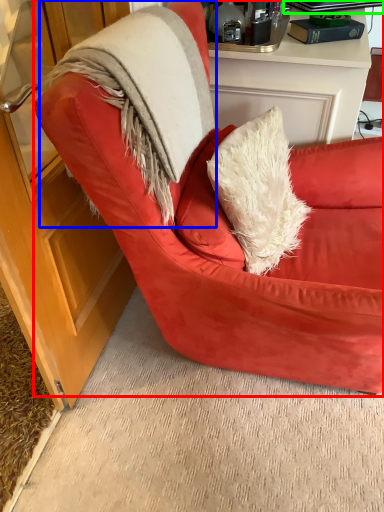
Question: Estimate the real-world distances between objects in this image. Which object is closer to chair (highlighted by a red box), fur coat (highlighted by a blue box) or laptop (highlighted by a green box)?

Choices:
 (A) fur coat
 (B) laptop

Answer: (A)